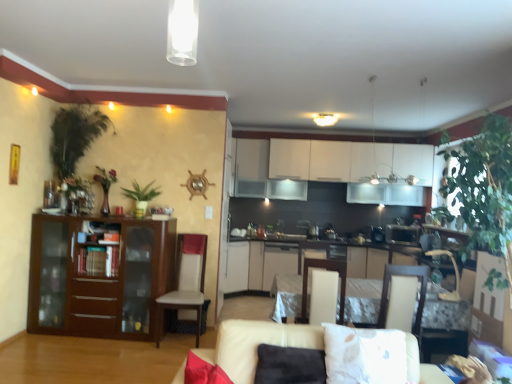
Identify the location of free point below white leather chair at left (from a real-world perspective). (184, 339).